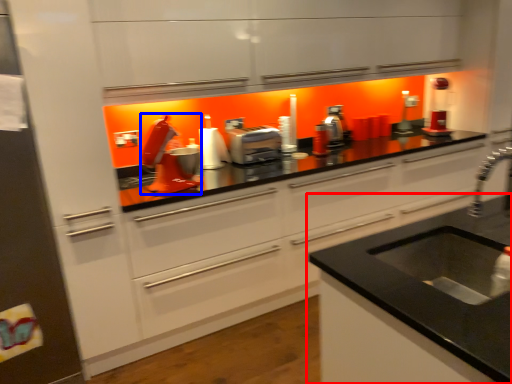
Question: Which object appears closest to the camera in this image, countertop (highlighted by a red box) or appliance (highlighted by a blue box)?

Choices:
 (A) countertop
 (B) appliance

Answer: (A)